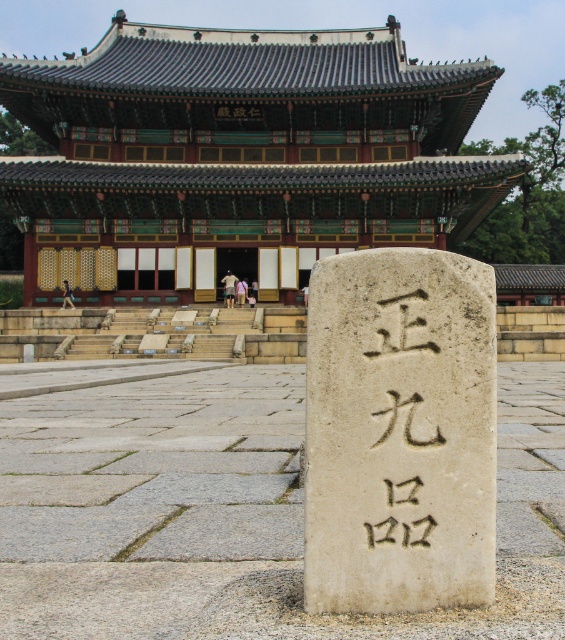
You are a visitor at Changdeokgung Palace and notice two stone objects in front of Injeongjeon Hall. The white stone pillar at center and the black stone carving at center. Which one is bigger?

The white stone pillar at center is larger in size compared to the black stone carving at center.

You are a tourist visiting the Injeongjeon Hall at Changdeokgung Palace. You notice two white stone objects in the center of the scene. Which one is closer to you, the white stone marker at center or the white stone pillar at center?

The white stone marker at center is closer to you because it is positioned in front of the white stone pillar at center.